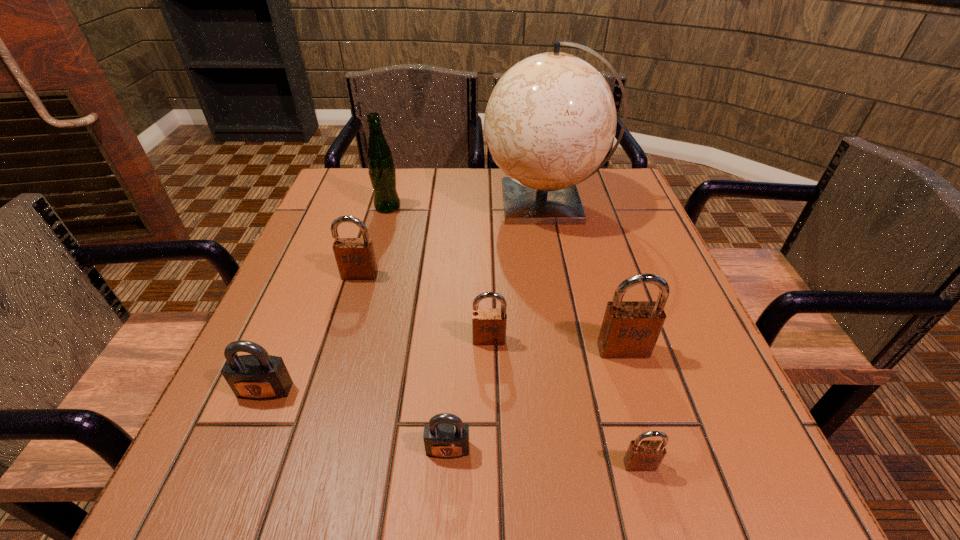
Identify which brown padlock is the third closest to the leftmost padlock. Please provide its 2D coordinates. Your answer should be formatted as a tuple, i.e. [(x, y)], where the tuple contains the x and y coordinates of a point satisfying the conditions above.

[(630, 329)]

Select which brown padlock is the second closest to the third biggest brown padlock. Please provide its 2D coordinates. Your answer should be formatted as a tuple, i.e. [(x, y)], where the tuple contains the x and y coordinates of a point satisfying the conditions above.

[(355, 257)]